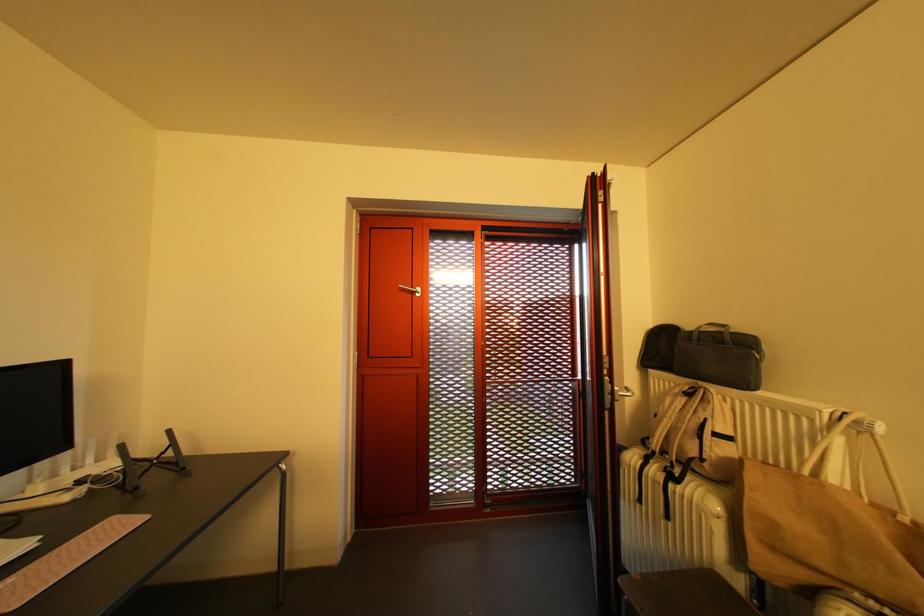
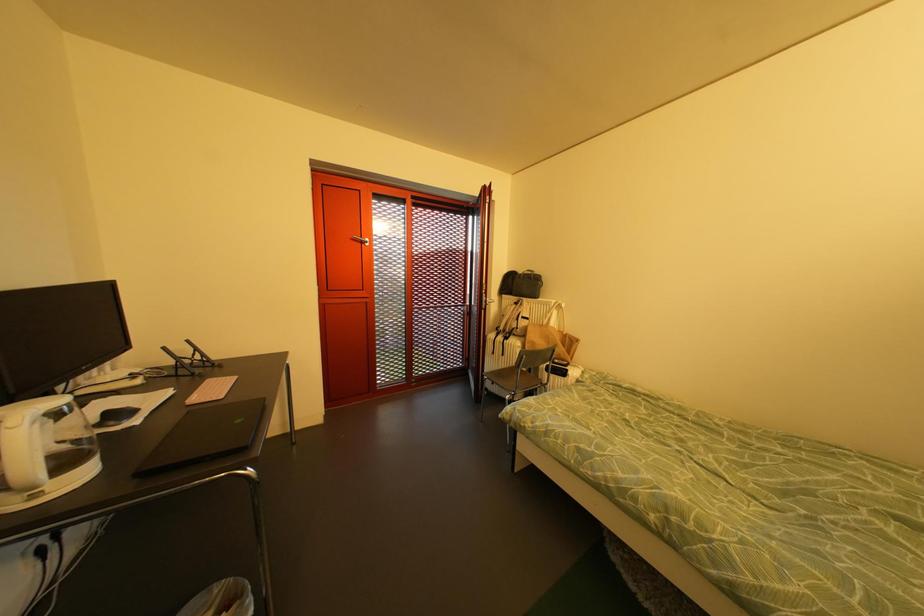
Question: The camera is either moving clockwise (left) or counter-clockwise (right) around the object. The first image is from the beginning of the video and the second image is from the end. Is the camera moving left or right when shooting the video?

Choices:
 (A) Left
 (B) Right

Answer: (A)